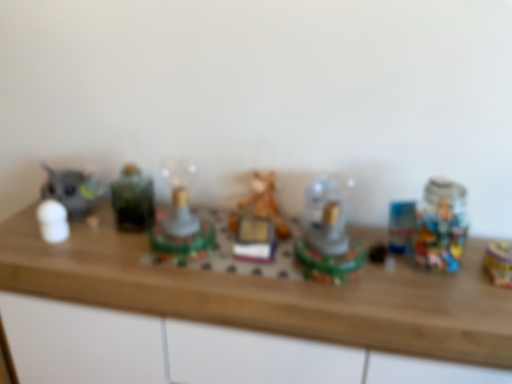
Identify the location of free space in front of white matte figurine at left, the first toy positioned from the left. The image size is (512, 384). (45, 257).